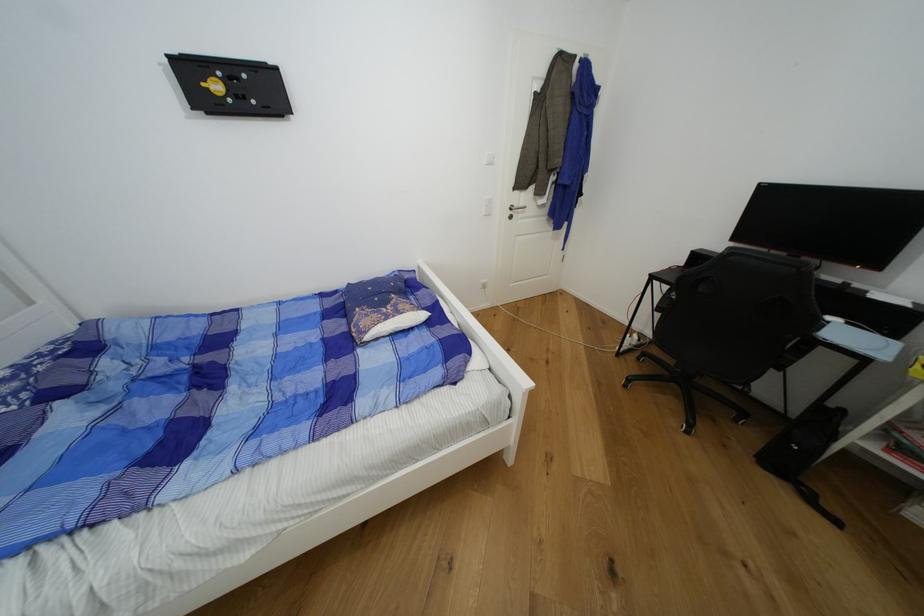
What do you see at coordinates (515, 209) in the screenshot?
I see `a silver door handle` at bounding box center [515, 209].